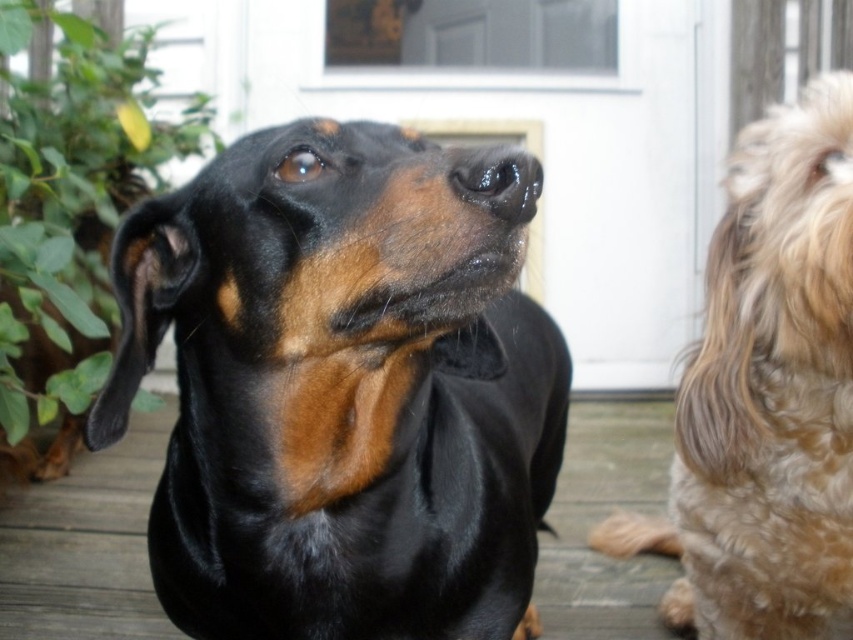
Looking at this image, can you confirm if black shiny dog at center is positioned to the right of black smooth deck at center?

No, black shiny dog at center is not to the right of black smooth deck at center.

Is black shiny dog at center above black smooth deck at center?

Indeed, black shiny dog at center is positioned over black smooth deck at center.

Is point (309, 339) farther from camera compared to point (99, 502)?

No, (309, 339) is in front of (99, 502).

Find the location of a particular element. This screenshot has height=640, width=853. black shiny dog at center is located at coordinates (339, 394).

Which of these two, white matte screen door at upper center or glossy black nose at center, stands shorter?

glossy black nose at center is shorter.

Does white matte screen door at upper center have a larger size compared to glossy black nose at center?

Yes, white matte screen door at upper center is bigger than glossy black nose at center.

The image size is (853, 640). Identify the location of white matte screen door at upper center. (544, 150).

Does black shiny dog at center have a lesser height compared to glossy black nose at center?

No.

Describe the element at coordinates (339, 394) in the screenshot. The image size is (853, 640). I see `black shiny dog at center` at that location.

Is point (300, 145) farther from camera compared to point (515, 186)?

Yes, point (300, 145) is farther from viewer.

Identify the location of black shiny dog at center. The width and height of the screenshot is (853, 640). (339, 394).